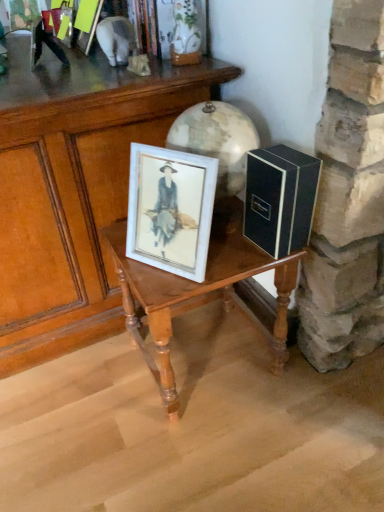
The image size is (384, 512). I want to click on vacant space that is to the left of wooden table at center, which ranks as the 2th table in left-to-right order, so click(82, 396).